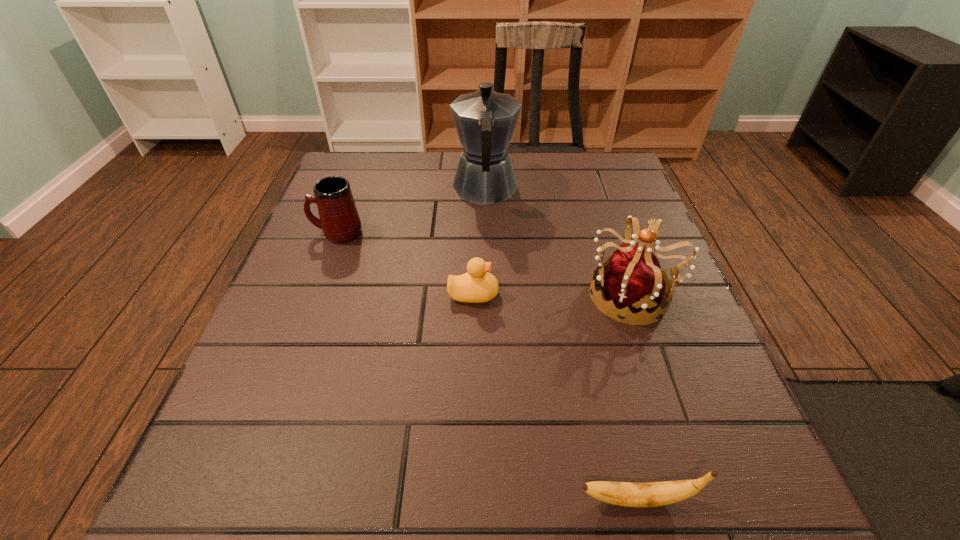
Locate an element on the screen. Image resolution: width=960 pixels, height=540 pixels. banana that is at the right edge is located at coordinates (651, 494).

What are the coordinates of `object present at the near right corner` in the screenshot? It's located at (651, 494).

In the image, there is a desktop. Find the location of `vacant space at the far edge`. vacant space at the far edge is located at coordinates (406, 180).

Locate an element on the screen. The height and width of the screenshot is (540, 960). vacant space at the near edge of the desktop is located at coordinates (636, 467).

Locate an element on the screen. The image size is (960, 540). vacant space at the left edge of the desktop is located at coordinates (357, 244).

Locate an element on the screen. vacant area at the right edge of the desktop is located at coordinates (591, 212).

Locate an element on the screen. free point at the near left corner is located at coordinates (251, 460).

Identify the location of free space at the far right corner of the desktop. (585, 157).

You are a GUI agent. You are given a task and a screenshot of the screen. Output one action in this format:
    pyautogui.click(x=<x>, y=<y>)
    Task: Click on the vacant space at the near right corner of the desktop
    The width and height of the screenshot is (960, 540).
    Given the screenshot: What is the action you would take?
    pyautogui.click(x=681, y=524)

Find the location of a particular element. Image resolution: width=960 pixels, height=540 pixels. vacant space that is in between the duck and the nearest object is located at coordinates (555, 396).